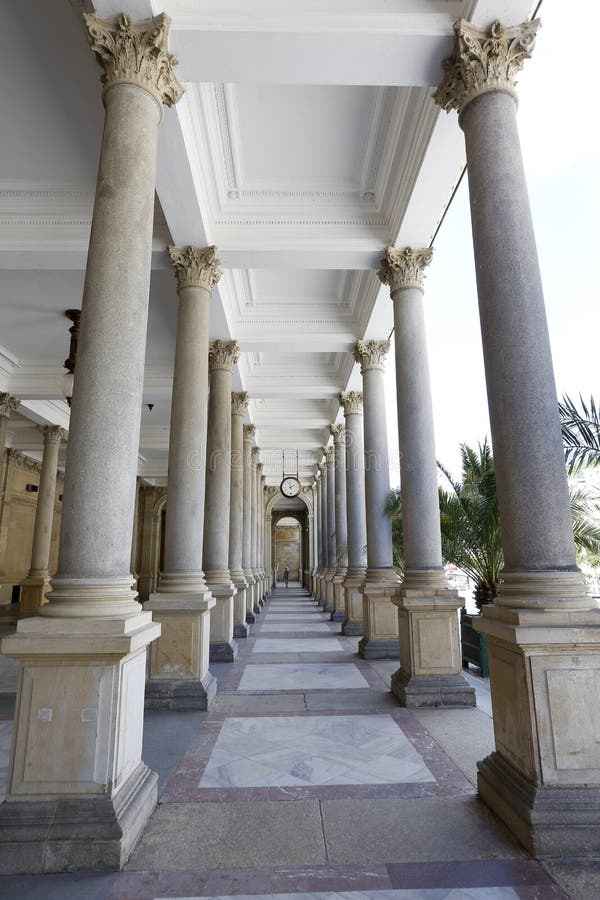
Look for where the column and the ceiling connect in the image and show me where they are. Your answer should be formatted as a list of tuples, i.e. [(x1, y1), (x2, y2), ...], where each tuple contains the x and y coordinates of a point satisfying the conditions above.

[(149, 54)]